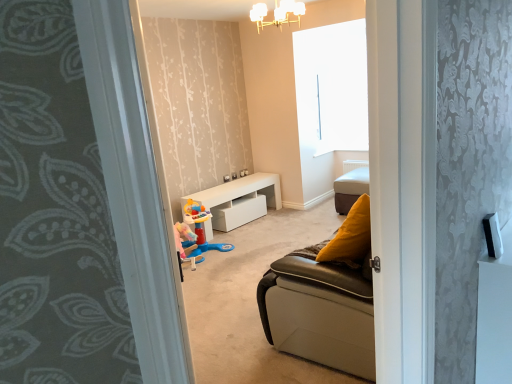
Question: Considering the relative sizes of pastel pink plastic toy at center and white glossy table at center in the image provided, is pastel pink plastic toy at center taller than white glossy table at center?

Choices:
 (A) yes
 (B) no

Answer: (A)

Question: Considering the relative positions of pastel pink plastic toy at center and white glossy table at center in the image provided, is pastel pink plastic toy at center to the right of white glossy table at center from the viewer's perspective?

Choices:
 (A) no
 (B) yes

Answer: (A)

Question: Are pastel pink plastic toy at center and white glossy table at center located far from each other?

Choices:
 (A) no
 (B) yes

Answer: (A)

Question: From the image's perspective, is pastel pink plastic toy at center beneath white glossy table at center?

Choices:
 (A) no
 (B) yes

Answer: (B)

Question: Can you confirm if pastel pink plastic toy at center is wider than white glossy table at center?

Choices:
 (A) yes
 (B) no

Answer: (A)

Question: Does pastel pink plastic toy at center have a smaller size compared to white glossy table at center?

Choices:
 (A) no
 (B) yes

Answer: (B)

Question: Is white glossy table at center wider than leather cushion at center?

Choices:
 (A) no
 (B) yes

Answer: (A)

Question: Can you confirm if white glossy table at center is taller than leather cushion at center?

Choices:
 (A) no
 (B) yes

Answer: (A)

Question: Is white glossy table at center to the left of leather cushion at center from the viewer's perspective?

Choices:
 (A) yes
 (B) no

Answer: (A)

Question: From the image's perspective, is white glossy table at center under leather cushion at center?

Choices:
 (A) yes
 (B) no

Answer: (A)

Question: Does white glossy table at center appear on the right side of leather cushion at center?

Choices:
 (A) no
 (B) yes

Answer: (A)

Question: Can you confirm if white glossy table at center is shorter than leather cushion at center?

Choices:
 (A) yes
 (B) no

Answer: (A)

Question: Can you confirm if white frosted glass chandelier at upper center is thinner than pastel pink plastic toy at center?

Choices:
 (A) no
 (B) yes

Answer: (B)